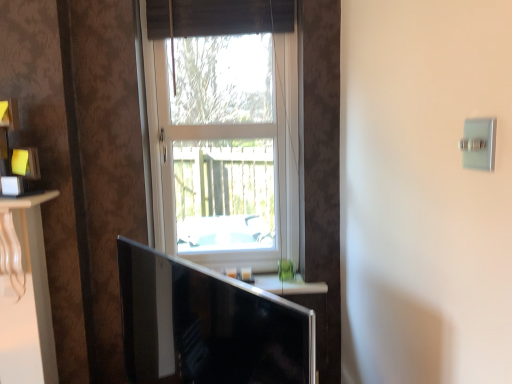
Question: Is the position of black glossy monitor at lower center less distant than that of satin silver switch at upper right?

Choices:
 (A) yes
 (B) no

Answer: (A)

Question: Is black glossy monitor at lower center thinner than satin silver switch at upper right?

Choices:
 (A) no
 (B) yes

Answer: (A)

Question: Can satin silver switch at upper right be found inside black glossy monitor at lower center?

Choices:
 (A) no
 (B) yes

Answer: (A)

Question: Is the surface of black glossy monitor at lower center in direct contact with satin silver switch at upper right?

Choices:
 (A) no
 (B) yes

Answer: (A)

Question: From a real-world perspective, is black glossy monitor at lower center below satin silver switch at upper right?

Choices:
 (A) no
 (B) yes

Answer: (B)

Question: From a real-world perspective, relative to white frame window at center, is brown woven curtain at upper center vertically above or below?

Choices:
 (A) above
 (B) below

Answer: (A)

Question: Does point (156, 16) appear closer or farther from the camera than point (184, 64)?

Choices:
 (A) farther
 (B) closer

Answer: (B)

Question: Do you think brown woven curtain at upper center is within white frame window at center, or outside of it?

Choices:
 (A) outside
 (B) inside

Answer: (B)

Question: Looking at their shapes, would you say brown woven curtain at upper center is wider or thinner than white frame window at center?

Choices:
 (A) thin
 (B) wide

Answer: (B)

Question: In the image, is satin silver switch at upper right positioned in front of or behind white frame window at center?

Choices:
 (A) behind
 (B) front

Answer: (B)

Question: Is satin silver switch at upper right taller or shorter than white frame window at center?

Choices:
 (A) short
 (B) tall

Answer: (A)

Question: In terms of size, does satin silver switch at upper right appear bigger or smaller than white frame window at center?

Choices:
 (A) big
 (B) small

Answer: (B)

Question: Is satin silver switch at upper right spatially inside white frame window at center, or outside of it?

Choices:
 (A) outside
 (B) inside

Answer: (A)

Question: Is point (202, 3) positioned closer to the camera than point (163, 286)?

Choices:
 (A) farther
 (B) closer

Answer: (A)

Question: Is brown woven curtain at upper center in front of or behind black glossy monitor at lower center in the image?

Choices:
 (A) front
 (B) behind

Answer: (B)